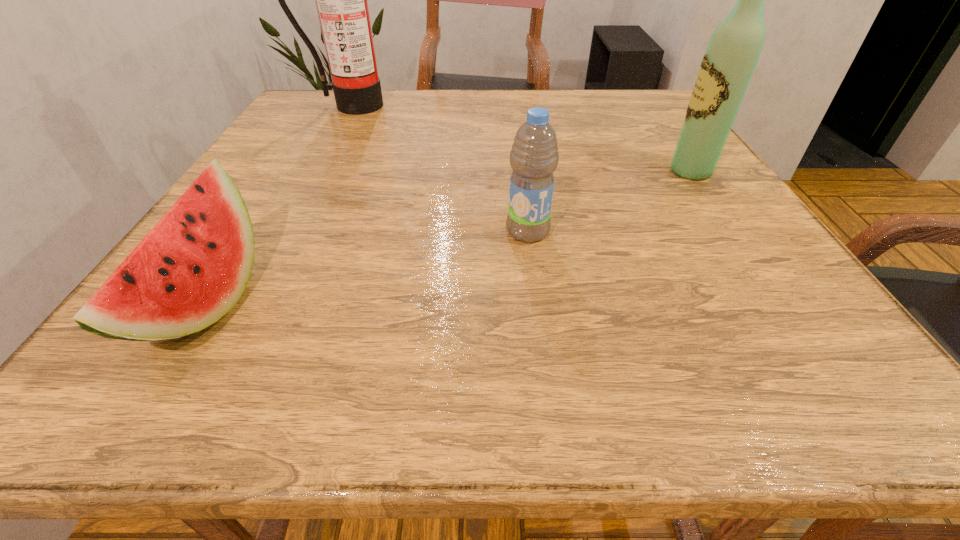
Image resolution: width=960 pixels, height=540 pixels. I want to click on free space at the near edge of the desktop, so click(267, 399).

Where is `free space at the right edge`? free space at the right edge is located at coordinates (664, 183).

In the image, there is a desktop. Where is `vacant space at the far right corner`? vacant space at the far right corner is located at coordinates (638, 117).

The height and width of the screenshot is (540, 960). I want to click on vacant area that lies between the wine bottle and the shortest object, so click(x=448, y=238).

At what (x,y) coordinates should I click in order to perform the action: click on vacant region between the third object from left to right and the farthest object. Please return your answer as a coordinate pair (x, y). Image resolution: width=960 pixels, height=540 pixels. Looking at the image, I should click on (439, 168).

This screenshot has height=540, width=960. I want to click on vacant area that lies between the farthest object and the water bottle, so click(439, 168).

Locate an element on the screen. free space between the second object from right to left and the farthest object is located at coordinates (439, 168).

The image size is (960, 540). Identify the location of vacant space that is in between the shortest object and the second shortest object. (367, 268).

Where is `vacant region between the fire extinguisher and the watermelon`? vacant region between the fire extinguisher and the watermelon is located at coordinates [277, 205].

This screenshot has height=540, width=960. What are the coordinates of `unoccupied area between the wine bottle and the shortest object` in the screenshot? It's located at (448, 238).